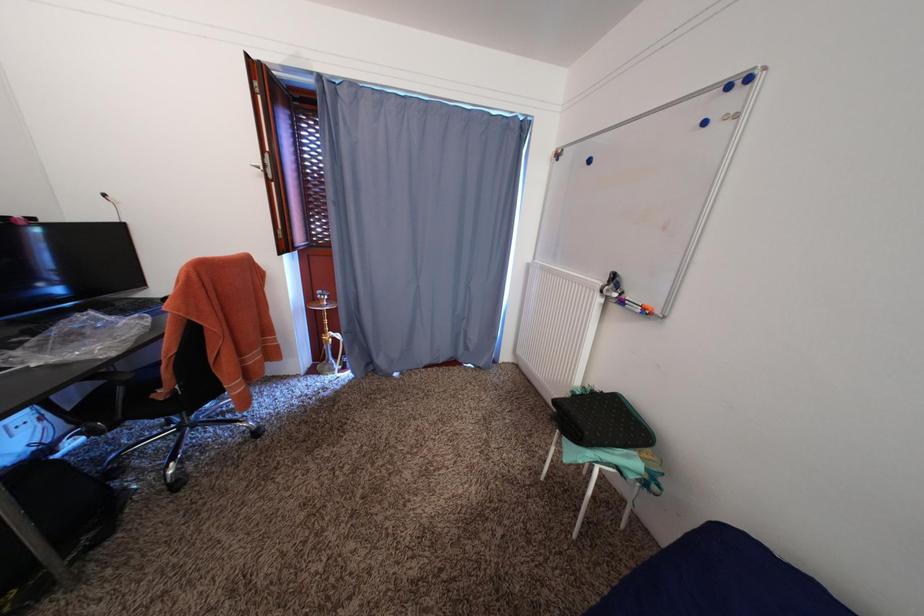
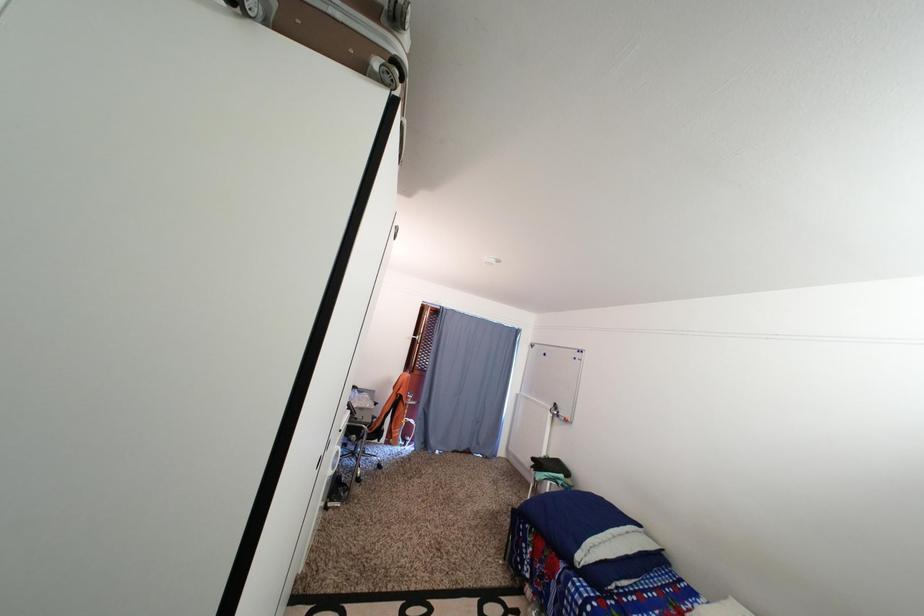
What movement of the cameraman would produce the second image?

The cameraman moved toward left, backward.